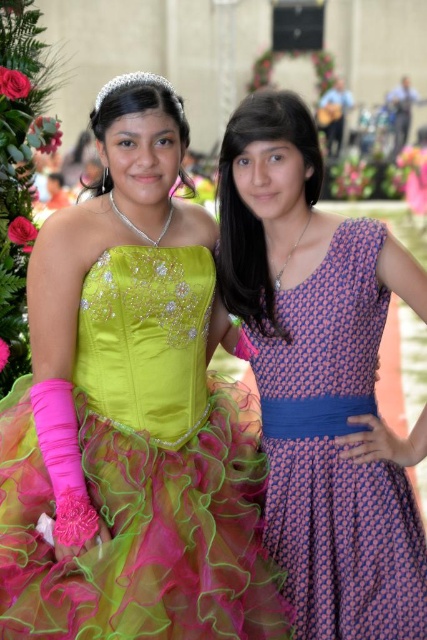
Based on the scene description and the positions of the objects, can you determine if the neon satin dress at left is positioned to the right or left of the woman on the right?

The neon satin dress at left is located at point (143, 474), which is to the left of the woman on the right.

You are a photographer at the event and need to capture a clear shot of both the neon satin dress at left and the purple printed fabric dress at right. Since the dresses are positioned in a way that one is in front of the other, which dress should you focus on to ensure the other is visible in the background?

The neon satin dress at left is in front of the purple printed fabric dress at right. To ensure the purple printed fabric dress at right is visible in the background, focus on the neon satin dress at left while keeping the camera aperture narrow to maintain depth of field.